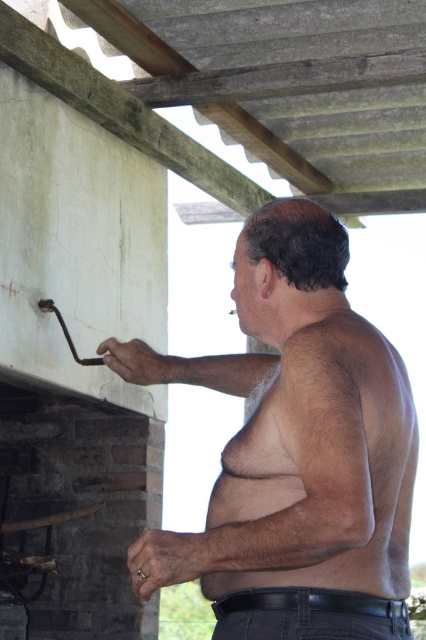
Does shiny metallic tool at upper left appear under hairy skin at upper right?

No, shiny metallic tool at upper left is not below hairy skin at upper right.

Between shiny metallic tool at upper left and hairy skin at upper right, which one appears on the right side from the viewer's perspective?

hairy skin at upper right is more to the right.

Describe the element at coordinates (296, 451) in the screenshot. This screenshot has height=640, width=426. I see `shiny metallic tool at upper left` at that location.

Where is `shiny metallic tool at upper left`? shiny metallic tool at upper left is located at coordinates (296, 451).